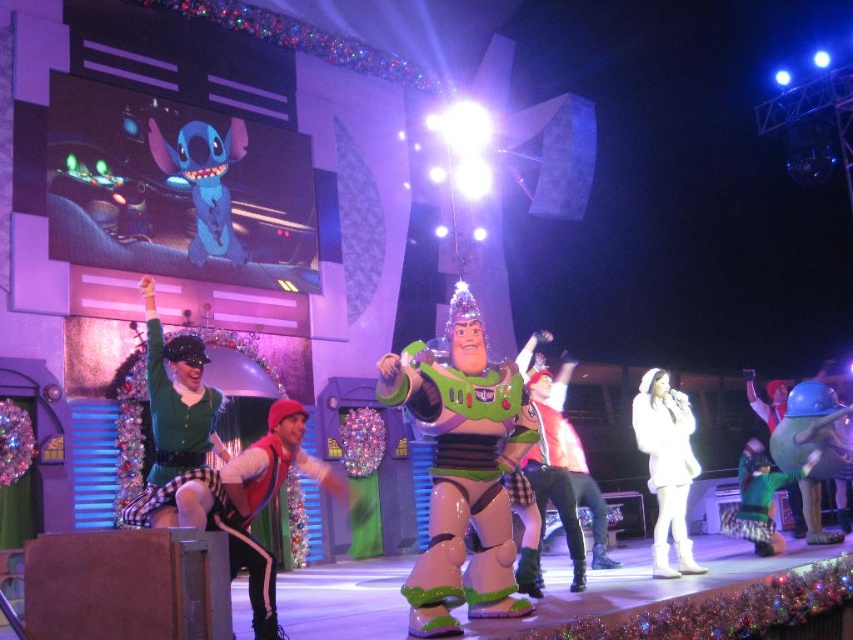
You are a photographer at the Toy Story stage show. You need to capture a closeup shot of the shiny plastic Buzz Lightyear at center. Your camera has a zoom lens that can focus on a specific coordinate point. The stage coordinates are mapped from 0 to 1 in both x and y axes. The point you need to focus on is at coordinate point (462, 468). Is this the correct coordinate to focus on to get a clear shot of the shiny plastic Buzz Lightyear at center?

Yes, the point at coordinate (462, 468) corresponds to the shiny plastic Buzz Lightyear at center, so focusing there will capture him clearly.

You are a stagehand preparing to adjust the lighting for the Toy Story performance. You notice two items on the stage, the white fur coat at center and the green fuzzy sweater at center. Which item is located to the left of the other?

The white fur coat at center is positioned on the left side of green fuzzy sweater at center.

You are an audience member sitting in the front row of the Toy Story stage show. You notice two points on the stage marked as point A and point B. Point A is at coordinate point (271, 604) and point B is at coordinate point (207, 410). From your seat, which point is closer to you?

Point A at coordinate point (271, 604) is closer to the viewer than point B at coordinate point (207, 410).